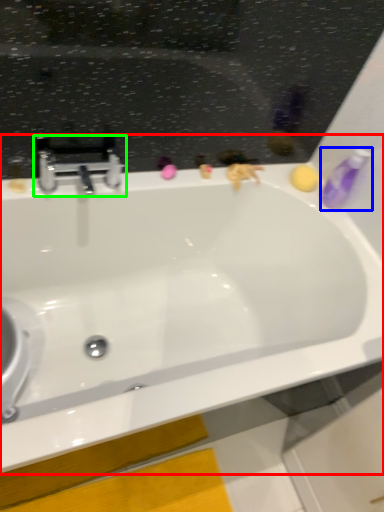
Question: Which is nearer to the bathtub (highlighted by a red box)? toiletry (highlighted by a blue box) or tap (highlighted by a green box).

Choices:
 (A) toiletry
 (B) tap

Answer: (B)